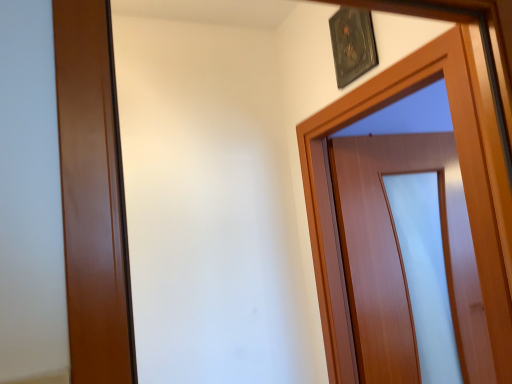
Question: Is wooden door at upper right wider or thinner than metallic plaque at upper center?

Choices:
 (A) thin
 (B) wide

Answer: (B)

Question: Is point (413, 86) closer or farther from the camera than point (353, 16)?

Choices:
 (A) farther
 (B) closer

Answer: (B)

Question: In the image, is wooden door at upper right on the left side or the right side of metallic plaque at upper center?

Choices:
 (A) right
 (B) left

Answer: (A)

Question: Relative to wooden door at upper right, is metallic plaque at upper center in front or behind?

Choices:
 (A) front
 (B) behind

Answer: (B)

Question: From a real-world perspective, relative to wooden door at upper right, is metallic plaque at upper center vertically above or below?

Choices:
 (A) above
 (B) below

Answer: (A)

Question: Considering the positions of metallic plaque at upper center and wooden door at upper right in the image, is metallic plaque at upper center taller or shorter than wooden door at upper right?

Choices:
 (A) tall
 (B) short

Answer: (B)

Question: Considering the positions of metallic plaque at upper center and wooden door at upper right in the image, is metallic plaque at upper center wider or thinner than wooden door at upper right?

Choices:
 (A) wide
 (B) thin

Answer: (B)